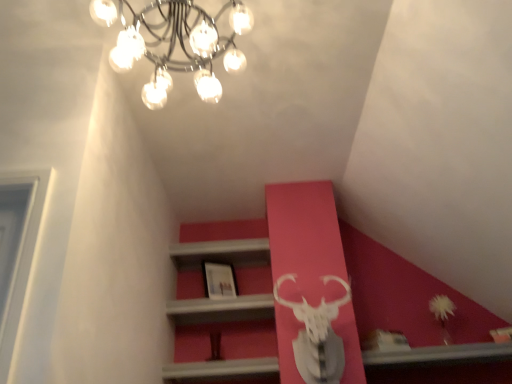
Question: Is matte white picture frame at center spatially inside metallic chandelier at upper center, or outside of it?

Choices:
 (A) outside
 (B) inside

Answer: (A)

Question: Considering the relative positions of matte white picture frame at center and metallic chandelier at upper center in the image provided, is matte white picture frame at center to the left or to the right of metallic chandelier at upper center?

Choices:
 (A) right
 (B) left

Answer: (A)

Question: Relative to metallic chandelier at upper center, is matte white picture frame at center in front or behind?

Choices:
 (A) behind
 (B) front

Answer: (A)

Question: Is metallic chandelier at upper center inside the boundaries of matte white picture frame at center, or outside?

Choices:
 (A) inside
 (B) outside

Answer: (B)

Question: In the image, is metallic chandelier at upper center positioned in front of or behind matte white picture frame at center?

Choices:
 (A) front
 (B) behind

Answer: (A)

Question: Is metallic chandelier at upper center to the left or to the right of matte white picture frame at center in the image?

Choices:
 (A) right
 (B) left

Answer: (B)

Question: In terms of size, does metallic chandelier at upper center appear bigger or smaller than matte white picture frame at center?

Choices:
 (A) big
 (B) small

Answer: (A)